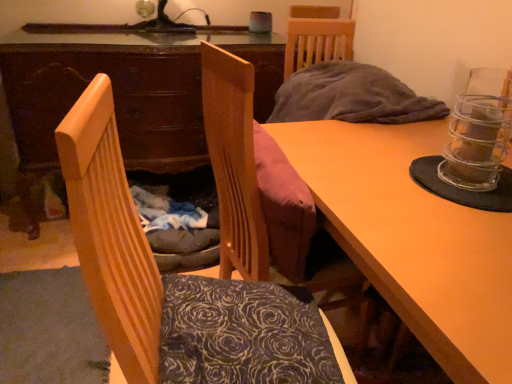
Question: Considering the relative sizes of wooden chair at left, marked as the 1th chair in a front-to-back arrangement, and dark floral fabric pillow at center in the image provided, is wooden chair at left, marked as the 1th chair in a front-to-back arrangement, smaller than dark floral fabric pillow at center?

Choices:
 (A) yes
 (B) no

Answer: (B)

Question: Can you confirm if wooden chair at left, marked as the 1th chair in a front-to-back arrangement, is bigger than dark floral fabric pillow at center?

Choices:
 (A) no
 (B) yes

Answer: (B)

Question: From the image's perspective, is wooden chair at left, marked as the 1th chair in a front-to-back arrangement, below dark floral fabric pillow at center?

Choices:
 (A) no
 (B) yes

Answer: (A)

Question: Considering the relative positions of wooden chair at left, marked as the 1th chair in a front-to-back arrangement, and dark floral fabric pillow at center in the image provided, is wooden chair at left, marked as the 1th chair in a front-to-back arrangement, to the left of dark floral fabric pillow at center from the viewer's perspective?

Choices:
 (A) no
 (B) yes

Answer: (B)

Question: Is the depth of wooden chair at left, which ranks as the second chair in back-to-front order, greater than that of dark floral fabric pillow at center?

Choices:
 (A) no
 (B) yes

Answer: (A)

Question: In terms of size, does wooden chair at left, marked as the 1th chair in a front-to-back arrangement, appear bigger or smaller than wooden table at center?

Choices:
 (A) big
 (B) small

Answer: (B)

Question: From the image's perspective, is wooden chair at left, which ranks as the second chair in back-to-front order, positioned above or below wooden table at center?

Choices:
 (A) above
 (B) below

Answer: (A)

Question: From a real-world perspective, is wooden chair at left, which ranks as the second chair in back-to-front order, physically located above or below wooden table at center?

Choices:
 (A) below
 (B) above

Answer: (B)

Question: Looking at their shapes, would you say wooden chair at left, which ranks as the second chair in back-to-front order, is wider or thinner than wooden table at center?

Choices:
 (A) wide
 (B) thin

Answer: (B)

Question: Visually, is wooden desk at center positioned to the left or to the right of wooden table at center?

Choices:
 (A) right
 (B) left

Answer: (B)

Question: Is point (46, 148) positioned closer to the camera than point (430, 152)?

Choices:
 (A) closer
 (B) farther

Answer: (B)

Question: From a real-world perspective, is wooden desk at center positioned above or below wooden table at center?

Choices:
 (A) below
 (B) above

Answer: (B)

Question: Is wooden desk at center wider or thinner than wooden table at center?

Choices:
 (A) thin
 (B) wide

Answer: (A)

Question: From a real-world perspective, is dark floral fabric pillow at center above or below velvet pink cushion at center, placed as the 1th chair when sorted from back to front?

Choices:
 (A) below
 (B) above

Answer: (A)

Question: Considering the relative positions of dark floral fabric pillow at center and velvet pink cushion at center, the second chair from the front, in the image provided, is dark floral fabric pillow at center to the left or to the right of velvet pink cushion at center, the second chair from the front,?

Choices:
 (A) left
 (B) right

Answer: (A)